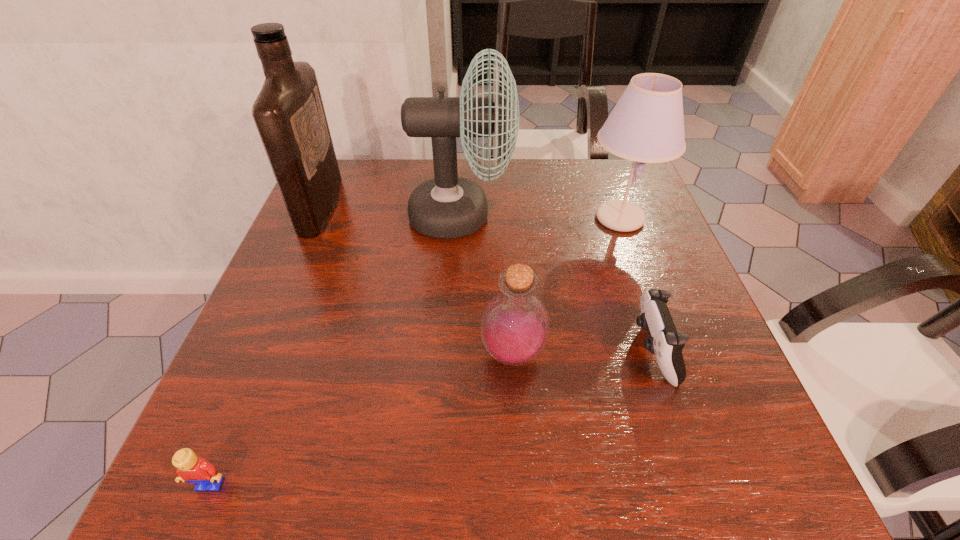
In the image, there is a desktop. Where is `vacant region at the near right corner`? vacant region at the near right corner is located at coordinates (708, 464).

Locate an element on the screen. The image size is (960, 540). unoccupied area between the bottle and the fan is located at coordinates (487, 285).

Where is `vacant area between the control and the liquor`? This screenshot has width=960, height=540. vacant area between the control and the liquor is located at coordinates (487, 278).

At what (x,y) coordinates should I click in order to perform the action: click on vacant point located between the control and the lampshade. Please return your answer as a coordinate pair (x, y). The width and height of the screenshot is (960, 540). Looking at the image, I should click on (636, 285).

You are a GUI agent. You are given a task and a screenshot of the screen. Output one action in this format:
    pyautogui.click(x=<x>, y=<y>)
    Task: Click on the empty location between the control and the bottle
    The width and height of the screenshot is (960, 540).
    Given the screenshot: What is the action you would take?
    [583, 352]

Identify the location of free space that is in between the control and the lampshade. The height and width of the screenshot is (540, 960). (636, 285).

At what (x,y) coordinates should I click in order to perform the action: click on empty space that is in between the fan and the Lego. Please return your answer as a coordinate pair (x, y). The height and width of the screenshot is (540, 960). Looking at the image, I should click on (336, 350).

You are a GUI agent. You are given a task and a screenshot of the screen. Output one action in this format:
    pyautogui.click(x=<x>, y=<y>)
    Task: Click on the empty space between the control and the liquor
    
    Given the screenshot: What is the action you would take?
    pyautogui.click(x=487, y=278)

The height and width of the screenshot is (540, 960). I want to click on free point between the fan and the liquor, so click(x=391, y=211).

The image size is (960, 540). I want to click on free space between the nearest object and the fan, so click(x=336, y=350).